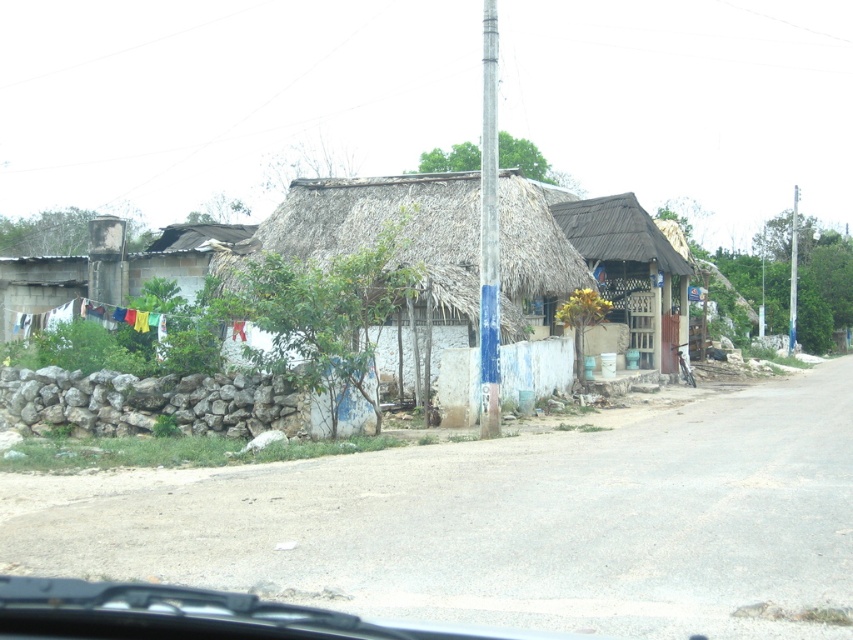
Question: Which of these objects is positioned closest to the white thatch hut at center?

Choices:
 (A) blue painted metal pole at center
 (B) smooth gray pole at right

Answer: (A)

Question: Observing the image, what is the correct spatial positioning of white thatch hut at center in reference to smooth gray pole at right?

Choices:
 (A) below
 (B) above

Answer: (A)

Question: Can you confirm if white thatch hut at center is smaller than blue painted metal pole at center?

Choices:
 (A) no
 (B) yes

Answer: (B)

Question: Which of the following is the farthest from the observer?

Choices:
 (A) smooth gray pole at right
 (B) blue painted metal pole at center
 (C) white thatch hut at center
 (D) thatched roof hut at center

Answer: (A)

Question: Is white thatch hut at center further to camera compared to thatched roof hut at center?

Choices:
 (A) yes
 (B) no

Answer: (B)

Question: Among these points, which one is nearest to the camera?

Choices:
 (A) pyautogui.click(x=788, y=332)
 (B) pyautogui.click(x=608, y=298)
 (C) pyautogui.click(x=358, y=230)
 (D) pyautogui.click(x=479, y=324)

Answer: (D)